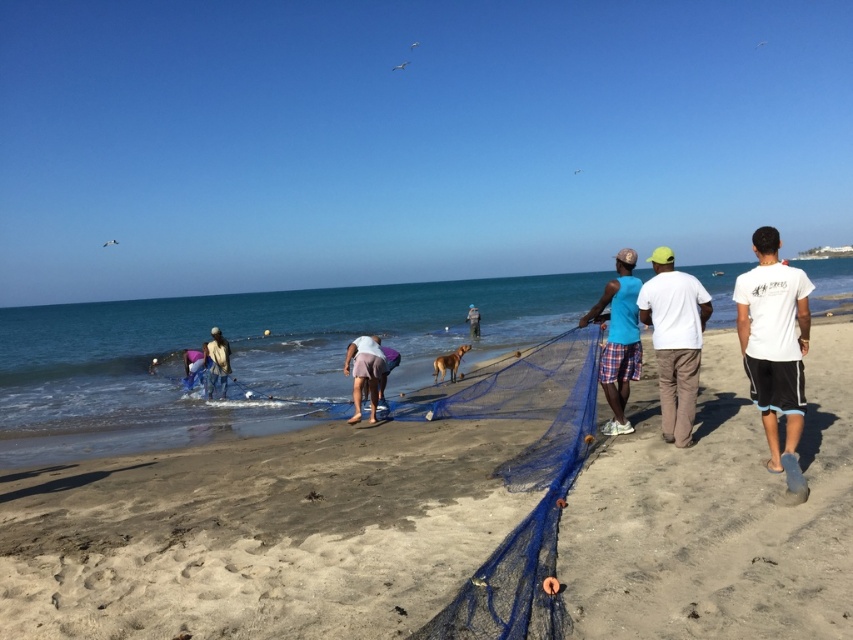
Question: Is white cotton t-shirt at right positioned at the back of blue fabric at lower left?

Choices:
 (A) no
 (B) yes

Answer: (A)

Question: Does blue plaid shorts at center have a greater width compared to light brown fabric jacket at lower left?

Choices:
 (A) yes
 (B) no

Answer: (A)

Question: Which object appears closest to the camera in this image?

Choices:
 (A) light brown fabric jacket at lower left
 (B) blue mesh net at center
 (C) white cotton t-shirt at right

Answer: (B)

Question: Which of these objects is positioned closest to the light brown fabric jacket at lower left?

Choices:
 (A) blue mesh net at center
 (B) white cotton t-shirt at right

Answer: (A)

Question: Which point is closer to the camera taking this photo?

Choices:
 (A) (628, 280)
 (B) (372, 417)
 (C) (757, 362)
 (D) (215, 340)

Answer: (C)

Question: Considering the relative positions of blue mesh net at center and light brown fabric jacket at lower left in the image provided, where is blue mesh net at center located with respect to light brown fabric jacket at lower left?

Choices:
 (A) above
 (B) below

Answer: (B)